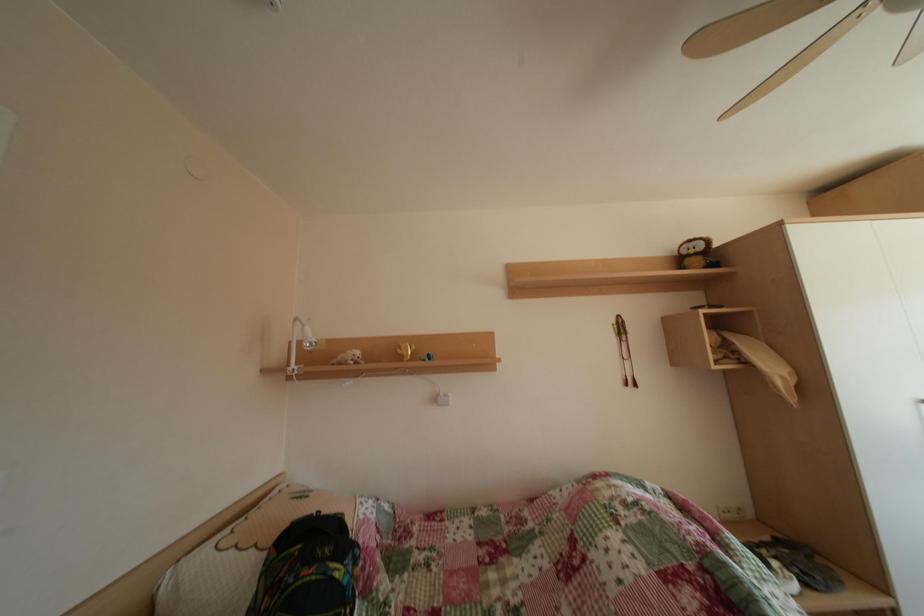
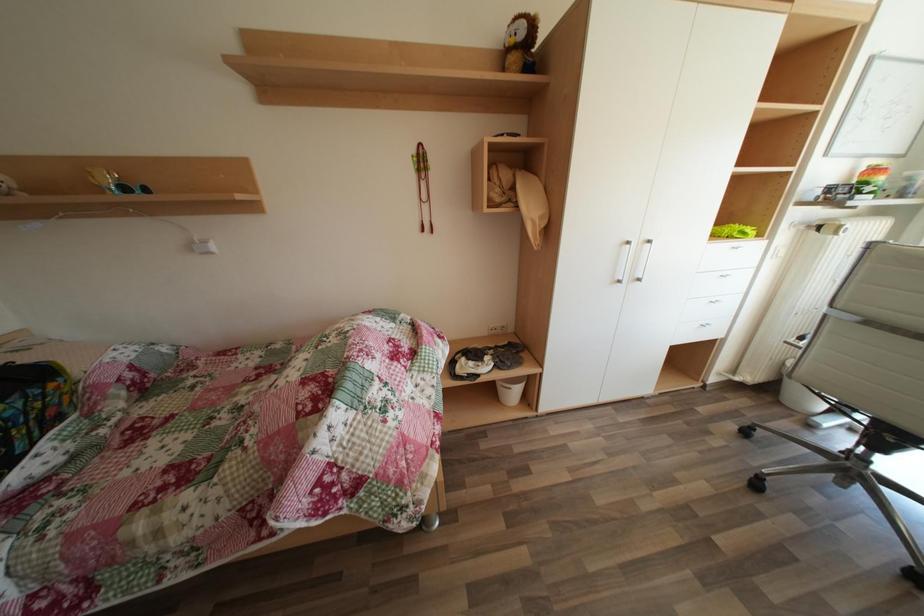
Question: The first image is from the beginning of the video and the second image is from the end. How did the camera likely rotate when shooting the video?

Choices:
 (A) Left
 (B) Right
 (C) Up
 (D) Down

Answer: (D)